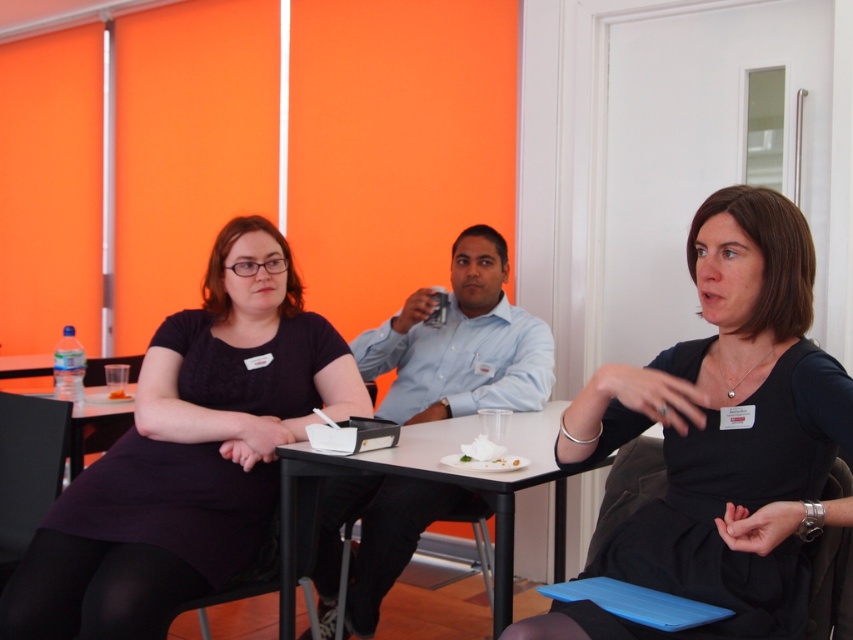
Does matte black dress at left appear on the right side of white creamy food at table center?

Indeed, matte black dress at left is positioned on the right side of white creamy food at table center.

Find the location of a particular element. The height and width of the screenshot is (640, 853). matte black dress at left is located at coordinates (189, 454).

Between black matte dress at center and white creamy food at table center, which one has less height?

Standing shorter between the two is white creamy food at table center.

Who is more distant from viewer, (659, 589) or (123, 394)?

Point (123, 394)

I want to click on black matte dress at center, so click(721, 436).

Measure the distance between point [601,403] and camera.

Point [601,403] is 4.73 feet from camera.

Is point (833, 381) behind point (506, 504)?

No, it is in front of (506, 504).

Where is `black matte dress at center`? black matte dress at center is located at coordinates (721, 436).